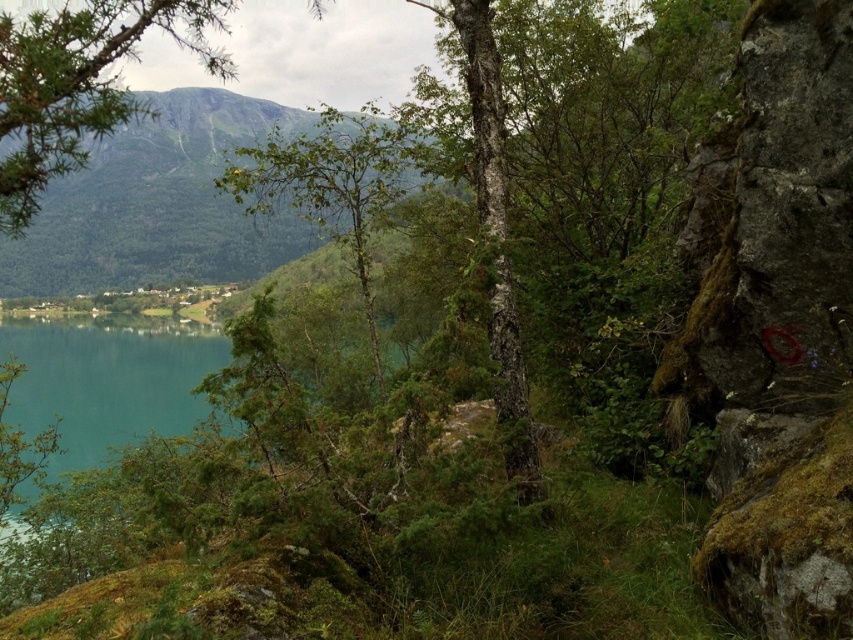
You are standing in the serene landscape and want to take a photo of both the green textured mountain at upper left and the green leafy tree at center. Which object will appear smaller in the photo?

The green textured mountain at upper left is positioned over the green leafy tree at center, so it will appear smaller in the photo because it is farther away from the camera.